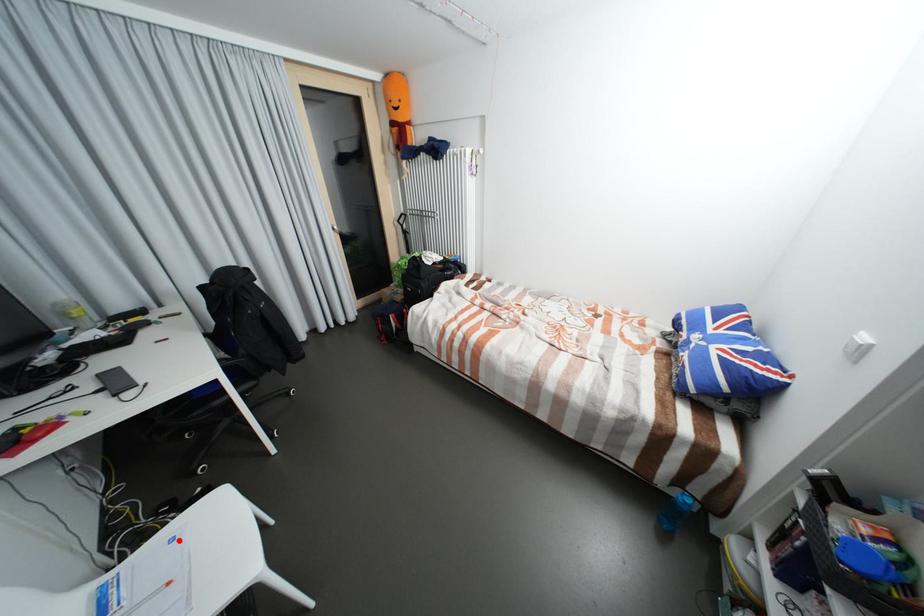
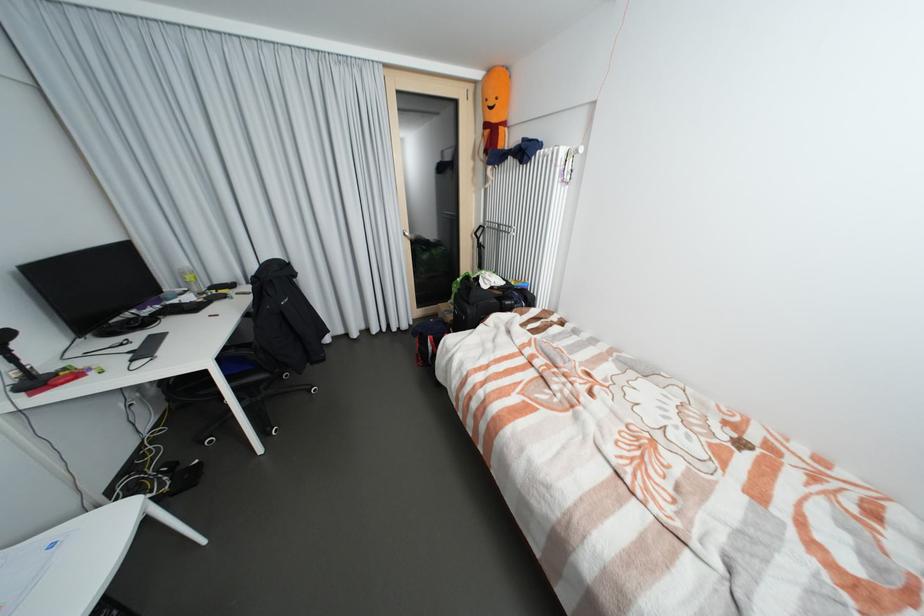
Question: I am providing you with two images of the same scene from different viewpoints. A red point is marked on the first image. Can you still see the location of the red point in image 2?

Choices:
 (A) Yes
 (B) No

Answer: (A)